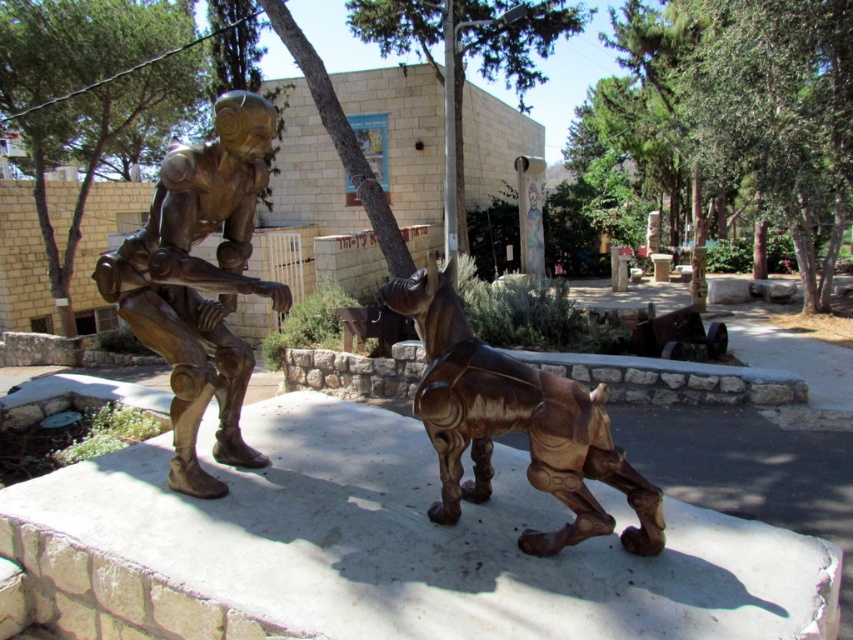
Who is positioned more to the right, bronze statue at left or bronze/wooden dog at center?

bronze/wooden dog at center is more to the right.

Can you confirm if bronze statue at left is wider than bronze/wooden dog at center?

In fact, bronze statue at left might be narrower than bronze/wooden dog at center.

Measure the distance between bronze statue at left and camera.

bronze statue at left is 2.62 meters from camera.

At what (x,y) coordinates should I click in order to perform the action: click on bronze statue at left. Please return your answer as a coordinate pair (x, y). The width and height of the screenshot is (853, 640). Looking at the image, I should click on (199, 282).